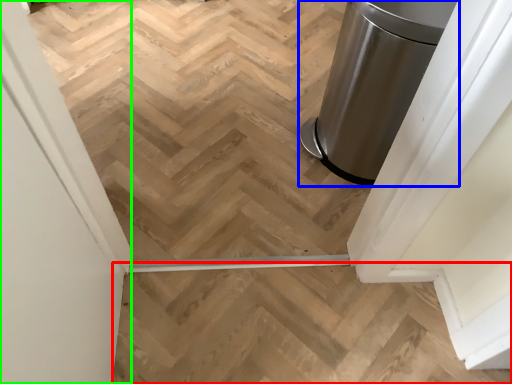
Question: Which is nearer to the stairs (highlighted by a red box)? waste container (highlighted by a blue box) or screen door (highlighted by a green box).

Choices:
 (A) waste container
 (B) screen door

Answer: (B)